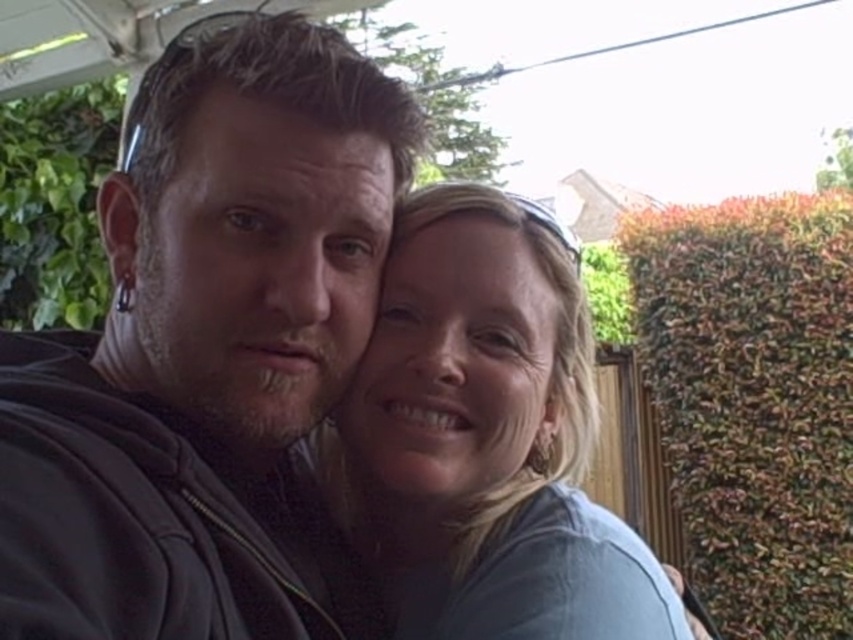
Is point (80, 356) farther from viewer compared to point (488, 300)?

No, it is not.

Which is in front, point (15, 484) or point (540, 312)?

Positioned in front is point (15, 484).

You are a GUI agent. You are given a task and a screenshot of the screen. Output one action in this format:
    pyautogui.click(x=<x>, y=<y>)
    Task: Click on the leather jacket at center
    The width and height of the screenshot is (853, 640).
    Given the screenshot: What is the action you would take?
    pyautogui.click(x=206, y=352)